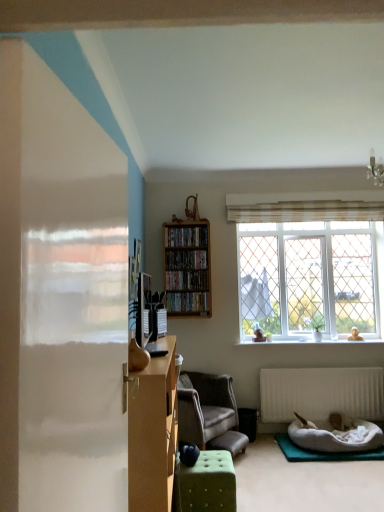
Question: Considering the relative sizes of wooden bookshelf at center, acting as the 3th shelf starting from the bottom, and wooden bookshelf at upper center, the second cabinet in the bottom-to-top sequence, in the image provided, is wooden bookshelf at center, acting as the 3th shelf starting from the bottom, smaller than wooden bookshelf at upper center, the second cabinet in the bottom-to-top sequence,?

Choices:
 (A) yes
 (B) no

Answer: (B)

Question: Can you confirm if wooden bookshelf at center, acting as the 3th shelf starting from the bottom, is shorter than wooden bookshelf at upper center, the second cabinet in the bottom-to-top sequence?

Choices:
 (A) yes
 (B) no

Answer: (B)

Question: From a real-world perspective, is wooden bookshelf at center, acting as the 3th shelf starting from the bottom, positioned over wooden bookshelf at upper center, which appears as the first cabinet when viewed from the top, based on gravity?

Choices:
 (A) yes
 (B) no

Answer: (B)

Question: Is wooden bookshelf at center, acting as the 3th shelf starting from the bottom, completely or partially outside of wooden bookshelf at upper center, which appears as the first cabinet when viewed from the top?

Choices:
 (A) no
 (B) yes

Answer: (B)

Question: Is wooden bookshelf at center, which ranks as the 1th shelf in top-to-bottom order, to the right of wooden bookshelf at upper center, the second cabinet in the bottom-to-top sequence, from the viewer's perspective?

Choices:
 (A) no
 (B) yes

Answer: (B)

Question: Is there a large distance between wooden bookshelf at center, acting as the 3th shelf starting from the bottom, and wooden bookshelf at upper center, the second cabinet in the bottom-to-top sequence?

Choices:
 (A) yes
 (B) no

Answer: (B)

Question: Considering the relative sizes of wooden bookshelf at center, the 1th shelf from the bottom, and white plush pet bed at lower right in the image provided, is wooden bookshelf at center, the 1th shelf from the bottom, shorter than white plush pet bed at lower right?

Choices:
 (A) yes
 (B) no

Answer: (A)

Question: Considering the relative sizes of wooden bookshelf at center, the 1th shelf from the bottom, and white plush pet bed at lower right in the image provided, is wooden bookshelf at center, the 1th shelf from the bottom, wider than white plush pet bed at lower right?

Choices:
 (A) yes
 (B) no

Answer: (B)

Question: Is wooden bookshelf at center, the 3th shelf positioned from the top, behind white plush pet bed at lower right?

Choices:
 (A) no
 (B) yes

Answer: (B)

Question: Can you confirm if wooden bookshelf at center, the 3th shelf positioned from the top, is taller than white plush pet bed at lower right?

Choices:
 (A) yes
 (B) no

Answer: (B)

Question: From the image's perspective, does wooden bookshelf at center, the 1th shelf from the bottom, appear lower than white plush pet bed at lower right?

Choices:
 (A) yes
 (B) no

Answer: (B)

Question: Is wooden bookshelf at center, the 1th shelf from the bottom, thinner than white plush pet bed at lower right?

Choices:
 (A) yes
 (B) no

Answer: (A)

Question: Can you confirm if green tufted ottoman at center is positioned to the left of wooden bookshelf at upper center, the second cabinet in the bottom-to-top sequence?

Choices:
 (A) no
 (B) yes

Answer: (A)